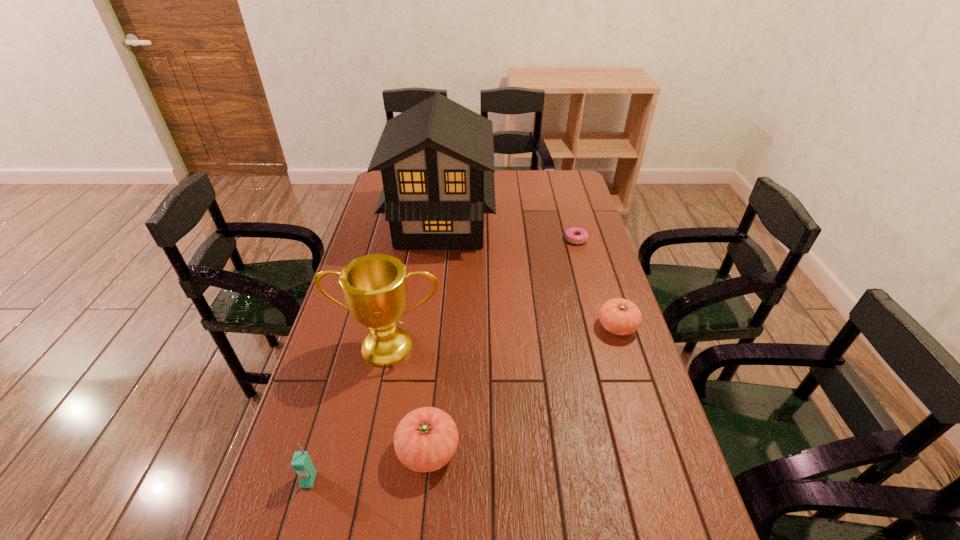
This screenshot has width=960, height=540. Find the location of `free spot located 0.200m on the front-facing side of the tallest object`. free spot located 0.200m on the front-facing side of the tallest object is located at coordinates (544, 224).

Identify the location of vacant space situated on the left of the shortest object. Image resolution: width=960 pixels, height=540 pixels. (470, 239).

Locate an element on the screen. The width and height of the screenshot is (960, 540). free space located 0.200m on the shiny surface of the second tallest object is located at coordinates (372, 436).

Find the location of a particular element. This screenshot has width=960, height=540. vacant space located on the keypad of the third tallest object is located at coordinates (x=298, y=517).

Identify the location of dollhouse that is at the left edge. (436, 159).

I want to click on award at the left edge, so click(x=374, y=287).

Locate an element on the screen. This screenshot has height=540, width=960. cellular telephone that is at the left edge is located at coordinates (301, 463).

Where is `tomato located in the right edge section of the desktop`? This screenshot has height=540, width=960. tomato located in the right edge section of the desktop is located at coordinates (619, 316).

Where is `doughnut situated at the right edge`? The image size is (960, 540). doughnut situated at the right edge is located at coordinates (575, 235).

Find the location of a particular element. vacant area at the far edge of the desktop is located at coordinates (503, 191).